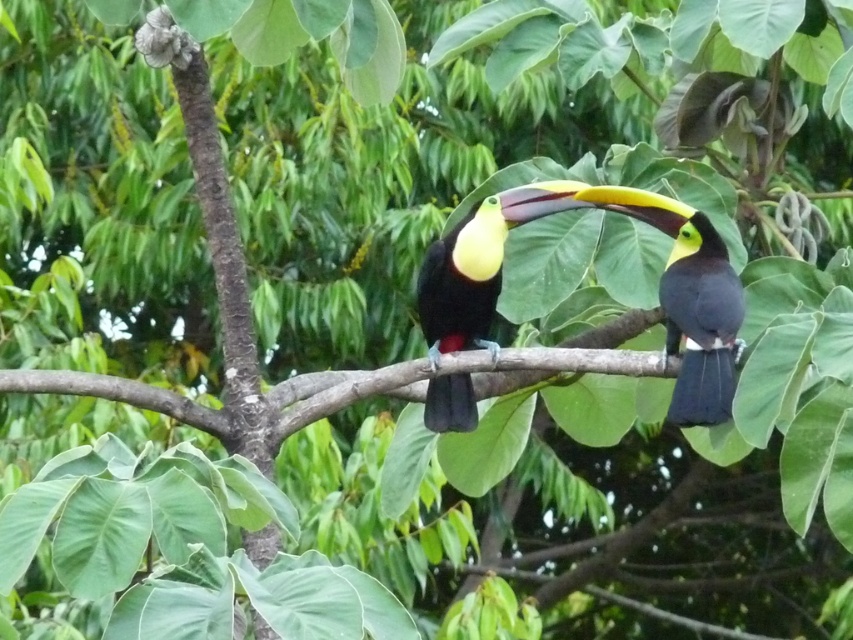
You are observing two toucans on a branch. The shiny black toucan at center and the yellow glossy toucan at center are facing each other. Which toucan is positioned to the left?

The yellow glossy toucan at center is positioned to the left of the shiny black toucan at center.

You are a birdwatcher observing the scene. You notice the shiny black toucan at center. Can you determine its exact position in the image using coordinates?

The shiny black toucan at center is located at point (671, 289).

You are a birdwatcher standing 3 meters away from a shiny black toucan at center. Can you safely observe it without disturbing it, given that the recommended safe distance for observing toucans is at least 3 meters?

The shiny black toucan at center is 2.92 meters away from the camera, which is slightly less than the recommended safe distance of 3 meters. Therefore, you are too close to safely observe the toucan without disturbing it.